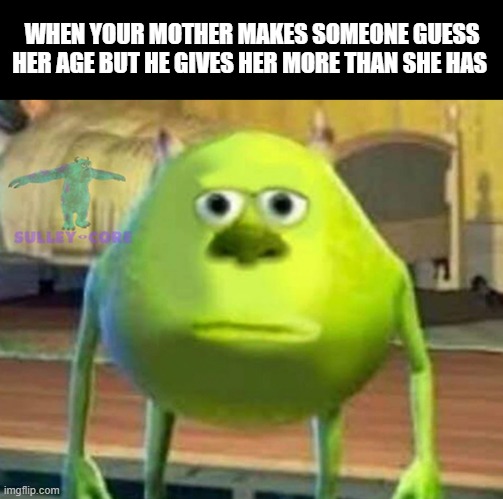
Locate an element on the screen. The width and height of the screenshot is (503, 499). foot board is located at coordinates (389, 189).